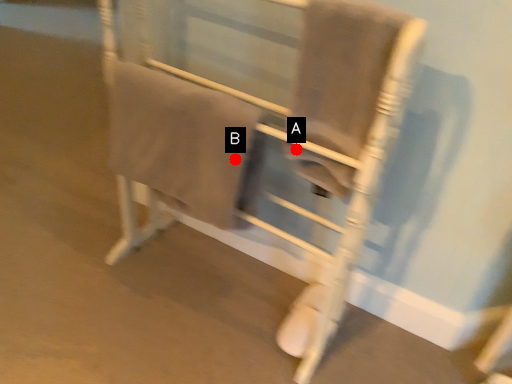
Question: Two points are circled on the image, labeled by A and B beside each circle. Which point is farther from the camera taking this photo?

Choices:
 (A) A is further
 (B) B is further

Answer: (A)